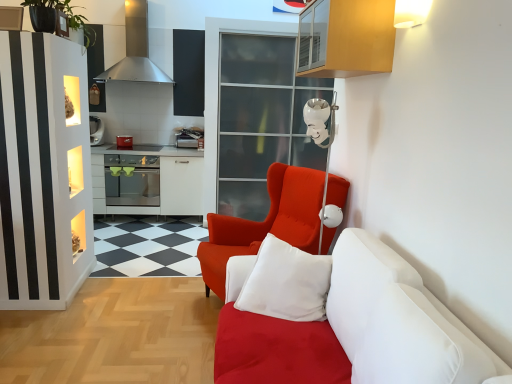
Question: In terms of height, does stainless steel exhaust hood at upper left look taller or shorter compared to transparent glass door at upper center?

Choices:
 (A) tall
 (B) short

Answer: (B)

Question: Considering the positions of stainless steel exhaust hood at upper left and transparent glass door at upper center in the image, is stainless steel exhaust hood at upper left bigger or smaller than transparent glass door at upper center?

Choices:
 (A) small
 (B) big

Answer: (A)

Question: Considering the real-world distances, which object is farthest from the stainless steel oven at left?

Choices:
 (A) wooden cabinet at upper right
 (B) satin red armchair at center
 (C) stainless steel exhaust hood at upper left
 (D) white fabric couch at lower right
 (E) satin silver oven at center

Answer: (D)

Question: Based on their relative distances, which object is nearer to the green leafy plant at upper left?

Choices:
 (A) white fabric couch at lower right
 (B) satin silver oven at center
 (C) wooden cabinet at upper right
 (D) satin red armchair at center
 (E) transparent glass door at upper center

Answer: (B)